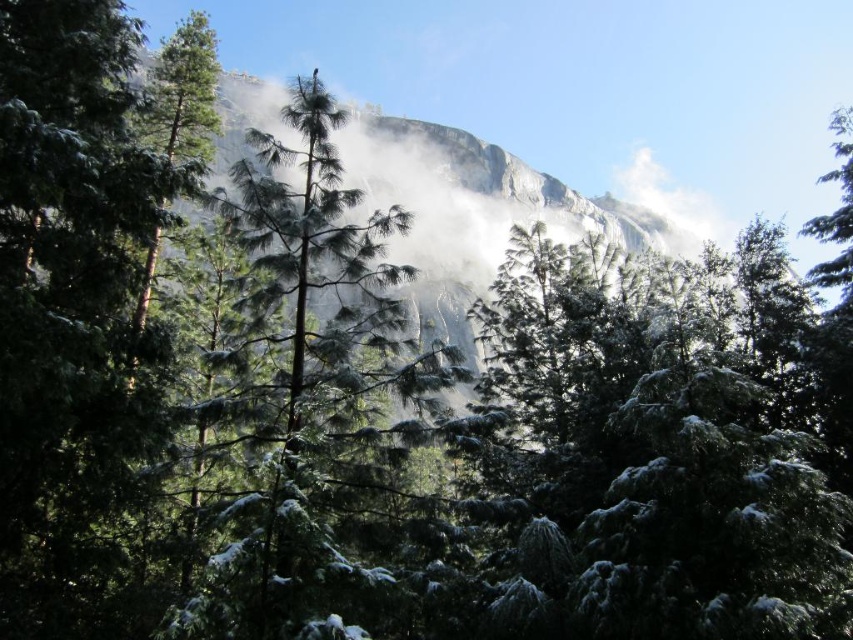
The width and height of the screenshot is (853, 640). What do you see at coordinates (311, 403) in the screenshot?
I see `green matte tree at center` at bounding box center [311, 403].

Is green matte tree at center below white fluffy cloud at upper center?

Correct, green matte tree at center is located below white fluffy cloud at upper center.

Describe the element at coordinates (311, 403) in the screenshot. I see `green matte tree at center` at that location.

The image size is (853, 640). I want to click on green matte tree at center, so click(311, 403).

Is rocky cliff at center smaller than white fluffy cloud at upper center?

No, rocky cliff at center is not smaller than white fluffy cloud at upper center.

Between rocky cliff at center and white fluffy cloud at upper center, which one is positioned higher?

white fluffy cloud at upper center

Which is behind, point (468, 349) or point (654, 176)?

The point (654, 176) is behind.

Find the location of a particular element. The image size is (853, 640). rocky cliff at center is located at coordinates (466, 212).

How distant is green matte tree at center from rocky cliff at center?

They are 147.46 feet apart.

Who is positioned more to the right, green matte tree at center or rocky cliff at center?

Positioned to the right is rocky cliff at center.

Which is behind, point (403, 499) or point (347, 176)?

The point (347, 176) is more distant.

Where is `green matte tree at center`? The height and width of the screenshot is (640, 853). green matte tree at center is located at coordinates (311, 403).